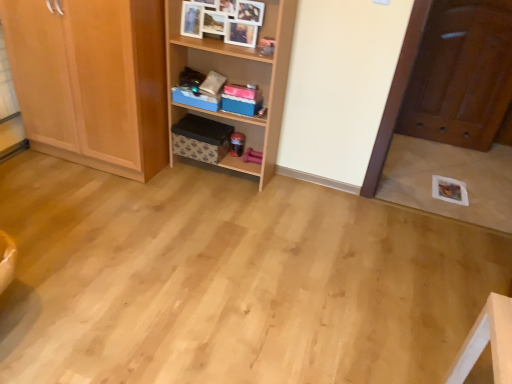
Locate an element on the screen. The width and height of the screenshot is (512, 384). free spot in front of wooden shelf at center is located at coordinates (214, 205).